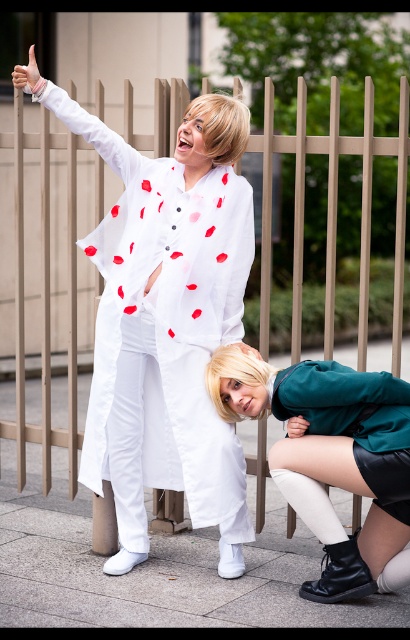
Question: Which of the following is the farthest from the observer?

Choices:
 (A) teal-green leather skirt at lower right
 (B) metallic gold fence at upper center

Answer: (B)

Question: Does metallic gold fence at upper center appear under teal-green leather skirt at lower right?

Choices:
 (A) yes
 (B) no

Answer: (B)

Question: In this image, where is metallic gold fence at upper center located relative to teal-green leather skirt at lower right?

Choices:
 (A) above
 (B) below

Answer: (A)

Question: Which object is farther from the camera taking this photo?

Choices:
 (A) metallic gold fence at upper center
 (B) teal-green leather skirt at lower right

Answer: (A)

Question: Among these objects, which one is nearest to the camera?

Choices:
 (A) teal-green leather skirt at lower right
 (B) metallic gold fence at upper center

Answer: (A)

Question: Is metallic gold fence at upper center smaller than teal-green leather skirt at lower right?

Choices:
 (A) yes
 (B) no

Answer: (A)